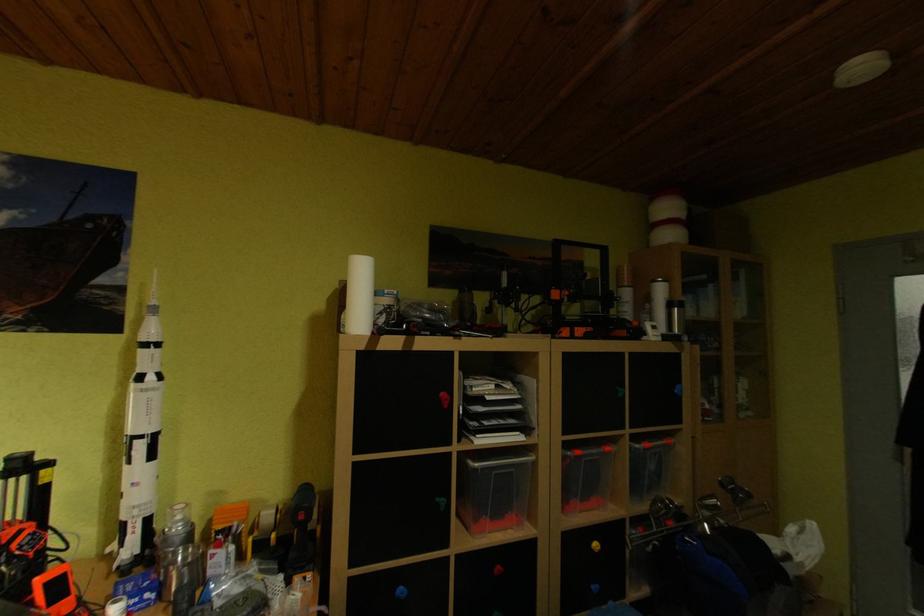
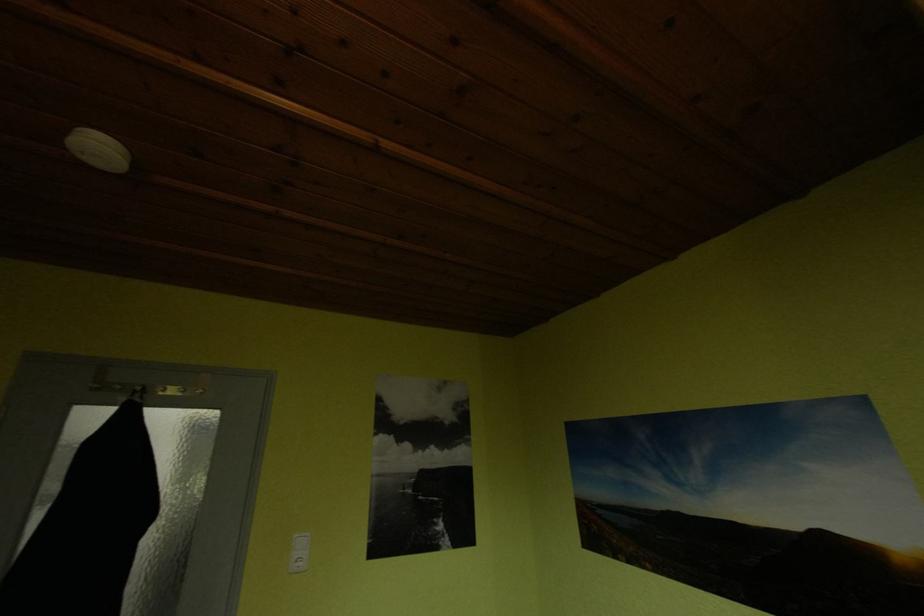
First-person continuous shooting, in which direction is the camera rotating?

The rotation direction of the camera is right-up.